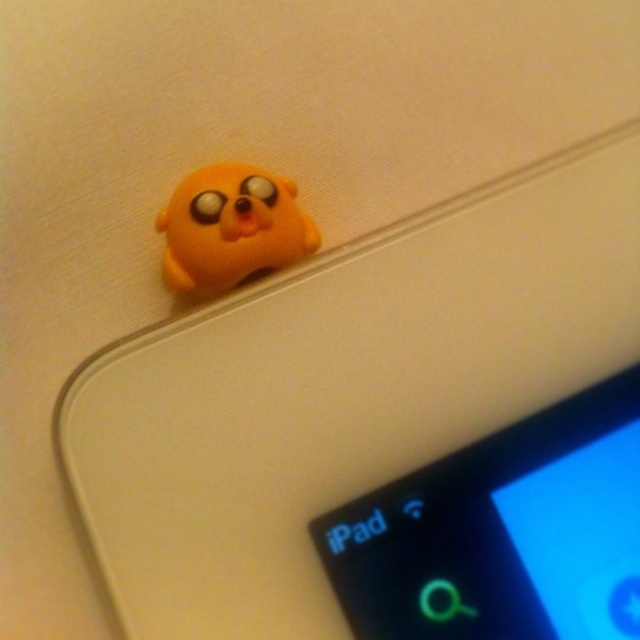
You are standing in front of the image and want to touch the point that is closer to you. Which point should you choose between point (445, 625) and point (186, 253)?

Point (445, 625) is in front of point (186, 253), so you should choose point (445, 625) as it is closer to you.

You are holding a matte black ipad at upper left that you want to place on the flat surface where the yellow plush creature is resting. Can you fit it there without overlapping the creature?

The matte black ipad at upper left is 1.03 meters away from camera, but the distance between the ipad and the flat surface isn wait, the description only mentions the distance from the camera, not the size of the surface or the creature. Hmm, maybe I need to think differently. The question is about fitting the iPad on the same surface as the plush creature without overlapping. The objects description only gives the distance of the iPad from the camera, not the size of the iPad or the surface. Wait, but the